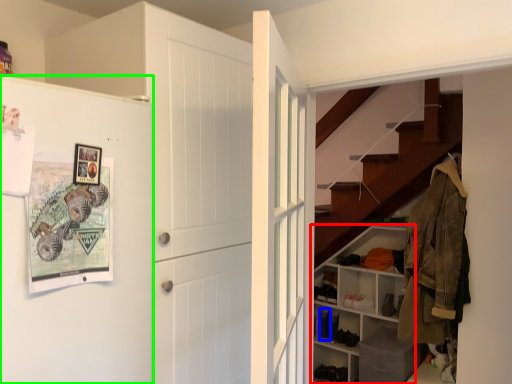
Question: Which object is positioned farthest from shelf (highlighted by a red box)? Select from shoe (highlighted by a blue box) and fridge (highlighted by a green box).

Choices:
 (A) shoe
 (B) fridge

Answer: (B)